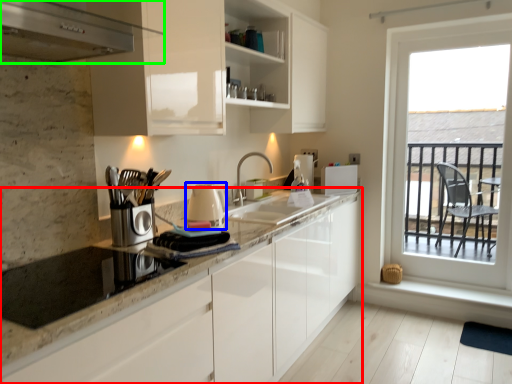
Question: Based on their relative distances, which object is farther from countertop (highlighted by a red box)? Choose from appliance (highlighted by a blue box) and kitchen appliance (highlighted by a green box).

Choices:
 (A) appliance
 (B) kitchen appliance

Answer: (B)